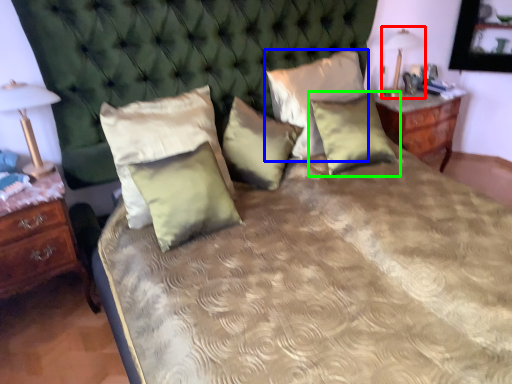
Question: Which is nearer to the bedside lamp (highlighted by a red box)? pillow (highlighted by a blue box) or pillow (highlighted by a green box).

Choices:
 (A) pillow
 (B) pillow

Answer: (A)